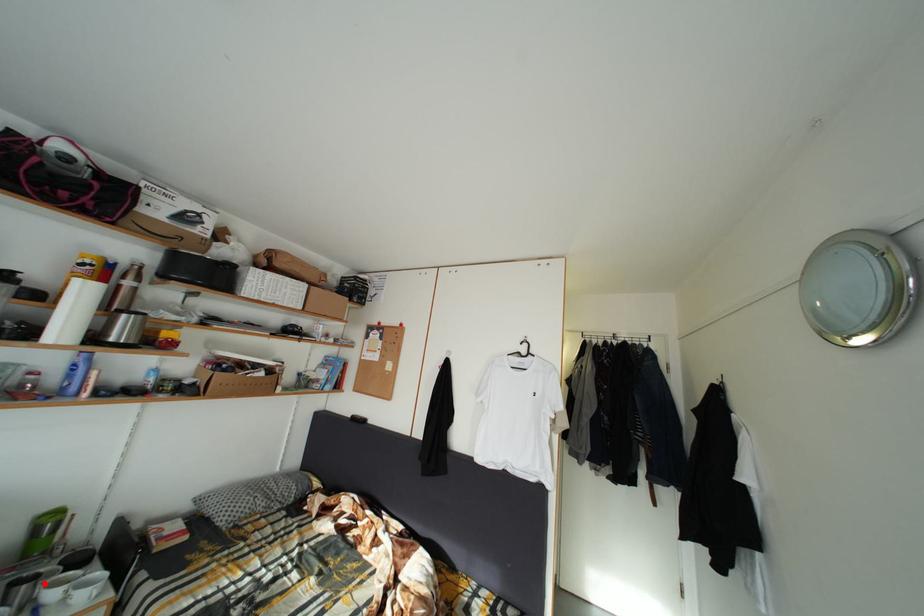
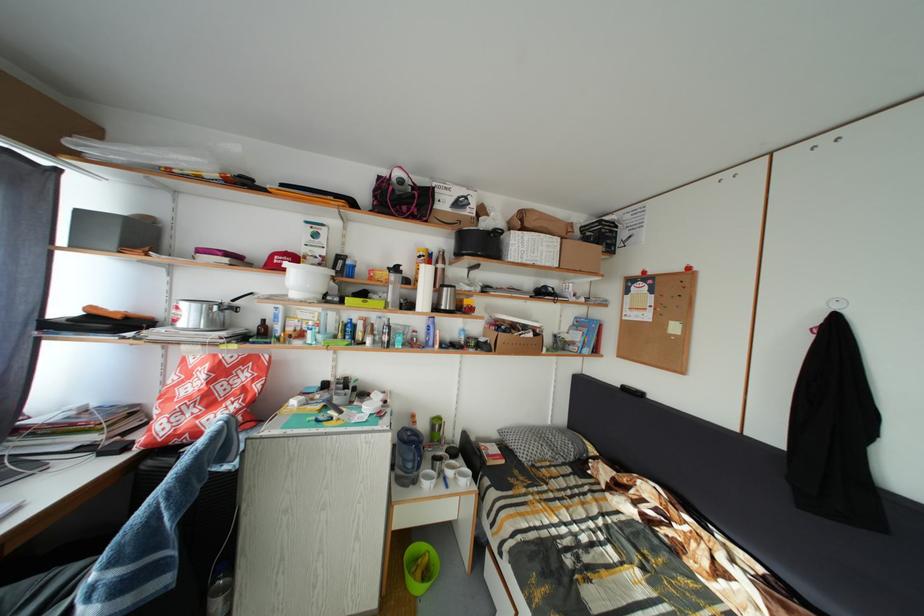
Question: I am providing you with two images of the same scene from different viewpoints. A red point is shown in image1. For the corresponding object point in image2, is it positioned nearer or farther from the camera?

Choices:
 (A) Nearer
 (B) Farther

Answer: (B)